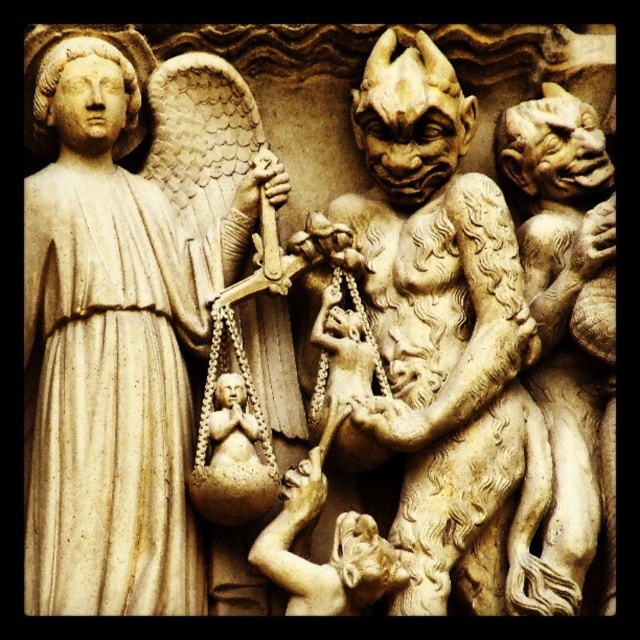
You are an art conservator examining the stone carving. You notice two specific points marked on the carving at coordinates point (32, 234) and point (561, 531). Which point is closer to the viewer?

Point (561, 531) is closer to the viewer because point (32, 234) is behind it.

Looking at the stone carving, you notice the matte stone angel at left and the beige stone gargoyle at right. Which of these two figures is bigger in size?

The matte stone angel at left is larger in size than the beige stone gargoyle at right.